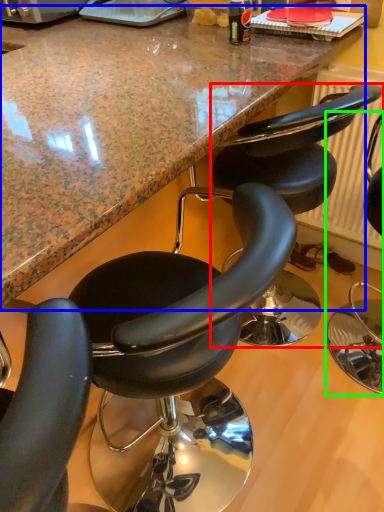
Question: Based on their relative distances, which object is nearer to chair (highlighted by a red box)? Choose from countertop (highlighted by a blue box) and chair (highlighted by a green box).

Choices:
 (A) countertop
 (B) chair

Answer: (A)